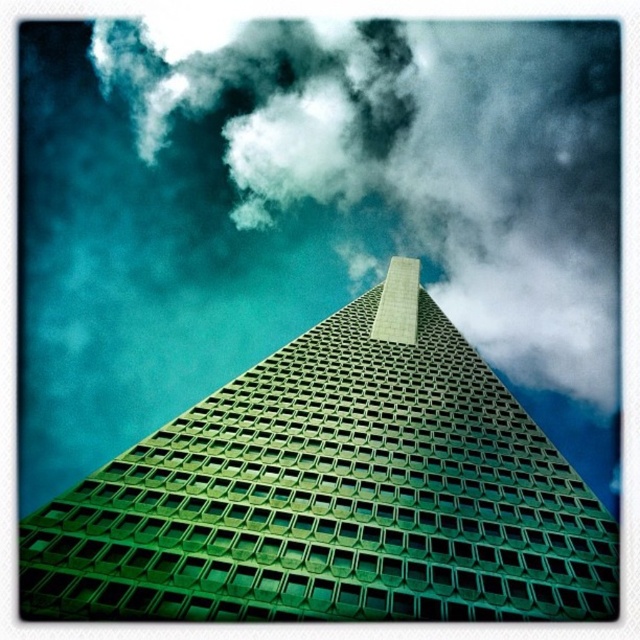
Question: Does green glassy building at center lie behind white fluffy cloud at upper center?

Choices:
 (A) no
 (B) yes

Answer: (A)

Question: Is green glassy building at center behind white fluffy cloud at upper center?

Choices:
 (A) no
 (B) yes

Answer: (A)

Question: Among these points, which one is farthest from the camera?

Choices:
 (A) (561, 611)
 (B) (292, 156)

Answer: (B)

Question: Is green glassy building at center behind white fluffy cloud at upper center?

Choices:
 (A) no
 (B) yes

Answer: (A)